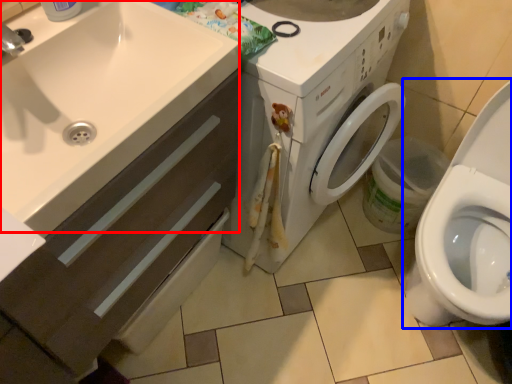
Question: Among these objects, which one is nearest to the camera, sink (highlighted by a red box) or toilet (highlighted by a blue box)?

Choices:
 (A) sink
 (B) toilet

Answer: (A)